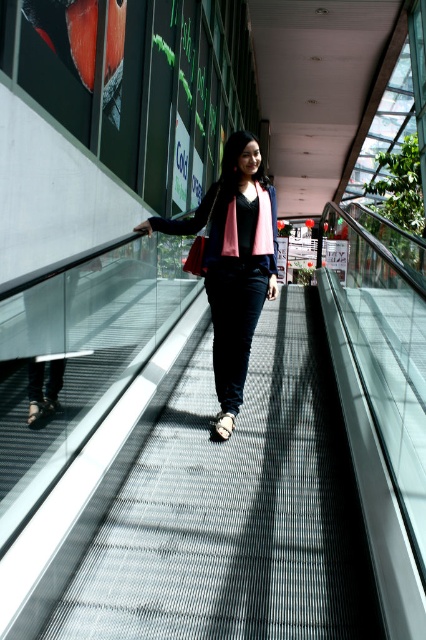
Is metallic gray escalator at center to the left of matte black jacket at center from the viewer's perspective?

No, metallic gray escalator at center is not to the left of matte black jacket at center.

Does metallic gray escalator at center have a larger size compared to matte black jacket at center?

Yes.

Image resolution: width=426 pixels, height=640 pixels. I want to click on metallic gray escalator at center, so click(x=236, y=509).